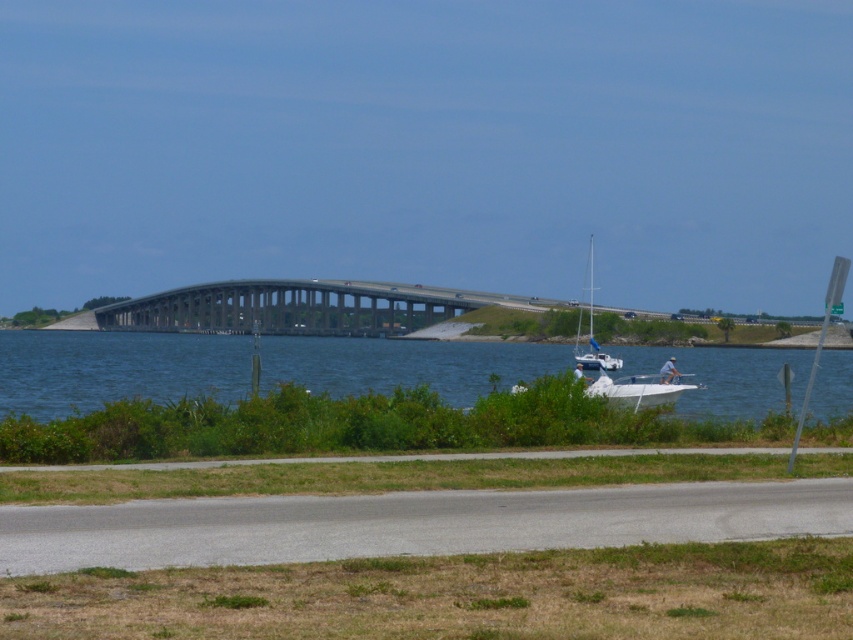
You are a photographer planning to capture the entire gray concrete bridge at center in your shot. Given the size difference between the blue water at lower center and the bridge, would you need to adjust your camera angle to include the entire bridge?

The blue water at lower center is larger in size than the gray concrete bridge at center. Therefore, to capture the entire gray concrete bridge at center, you might need to adjust your camera angle to ensure the bridge isn not overshadowed by the water in terms of size in the frame.

You are a delivery drone that needs to fly from the blue water at lower center to the gray concrete bridge at center. What is the shortest distance you must travel?

The shortest distance between the blue water at lower center and the gray concrete bridge at center is 16.94 meters.